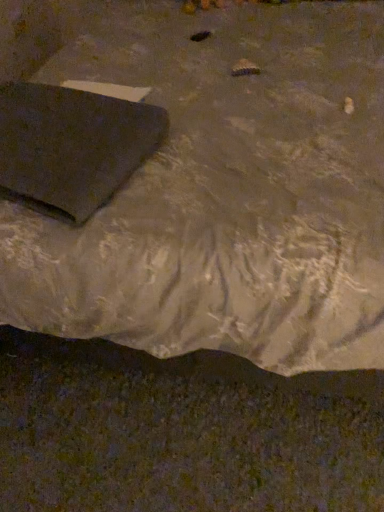
Question: From a real-world perspective, is matte black pad at lower left on matte black laptop at upper left?

Choices:
 (A) yes
 (B) no

Answer: (A)

Question: Is matte black laptop at upper left inside matte black pad at lower left?

Choices:
 (A) no
 (B) yes

Answer: (A)

Question: Does matte black pad at lower left have a lesser width compared to matte black laptop at upper left?

Choices:
 (A) yes
 (B) no

Answer: (A)

Question: Is matte black pad at lower left at the right side of matte black laptop at upper left?

Choices:
 (A) yes
 (B) no

Answer: (B)

Question: Is matte black pad at lower left bigger than matte black laptop at upper left?

Choices:
 (A) yes
 (B) no

Answer: (B)

Question: Can you confirm if matte black pad at lower left is wider than matte black laptop at upper left?

Choices:
 (A) no
 (B) yes

Answer: (A)

Question: From the image's perspective, is matte black laptop at upper left under matte black pad at lower left?

Choices:
 (A) yes
 (B) no

Answer: (B)

Question: Can we say matte black laptop at upper left lies outside matte black pad at lower left?

Choices:
 (A) no
 (B) yes

Answer: (B)

Question: Is matte black laptop at upper left touching matte black pad at lower left?

Choices:
 (A) no
 (B) yes

Answer: (A)

Question: Are matte black laptop at upper left and matte black pad at lower left far apart?

Choices:
 (A) yes
 (B) no

Answer: (B)

Question: Is matte black laptop at upper left smaller than matte black pad at lower left?

Choices:
 (A) no
 (B) yes

Answer: (A)

Question: Does matte black laptop at upper left turn towards matte black pad at lower left?

Choices:
 (A) no
 (B) yes

Answer: (B)

Question: From the image's perspective, is matte black pad at lower left positioned above or below matte black laptop at upper left?

Choices:
 (A) above
 (B) below

Answer: (B)